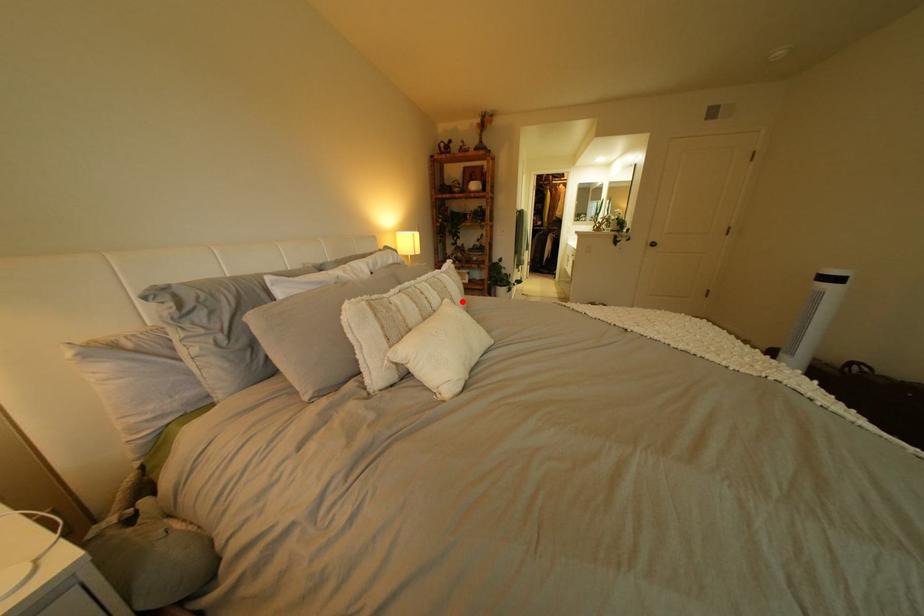
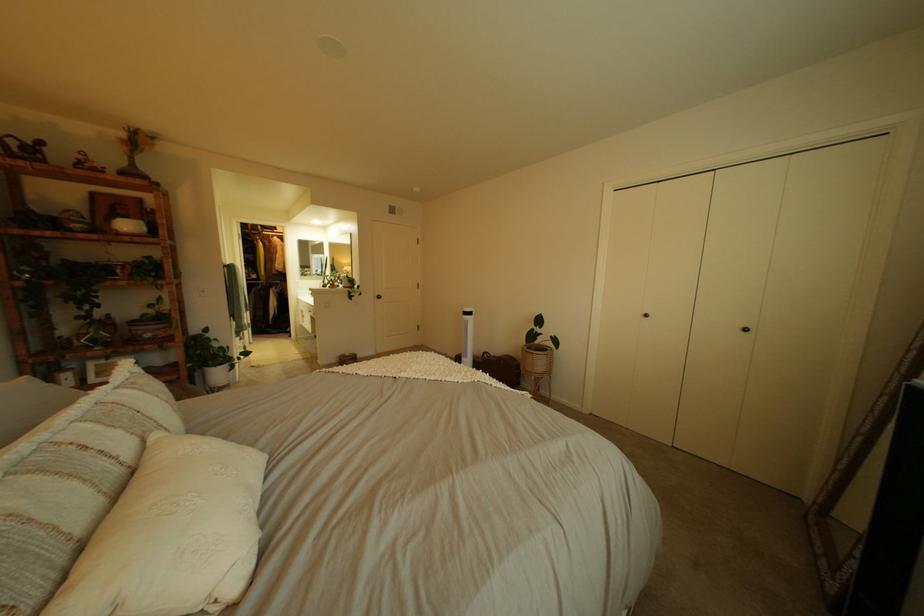
Question: I am providing you with two images of the same scene from different viewpoints. A red point is marked on the first image. Can you still see the location of the red point in image 2?

Choices:
 (A) Yes
 (B) No

Answer: (A)